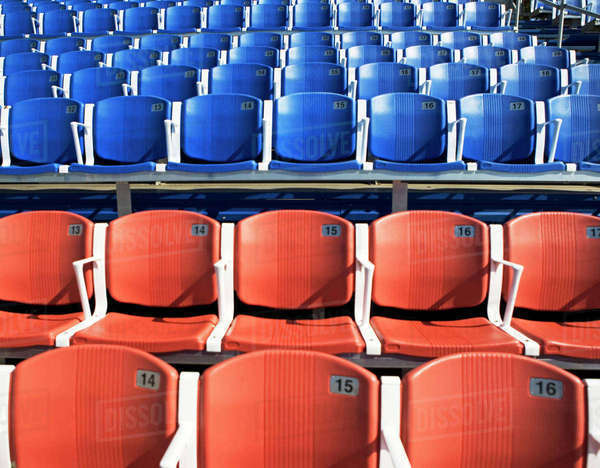
The width and height of the screenshot is (600, 468). What are the coordinates of `back row of red seats` in the screenshot? It's located at (36, 261), (151, 262), (297, 254), (435, 259), (535, 249).